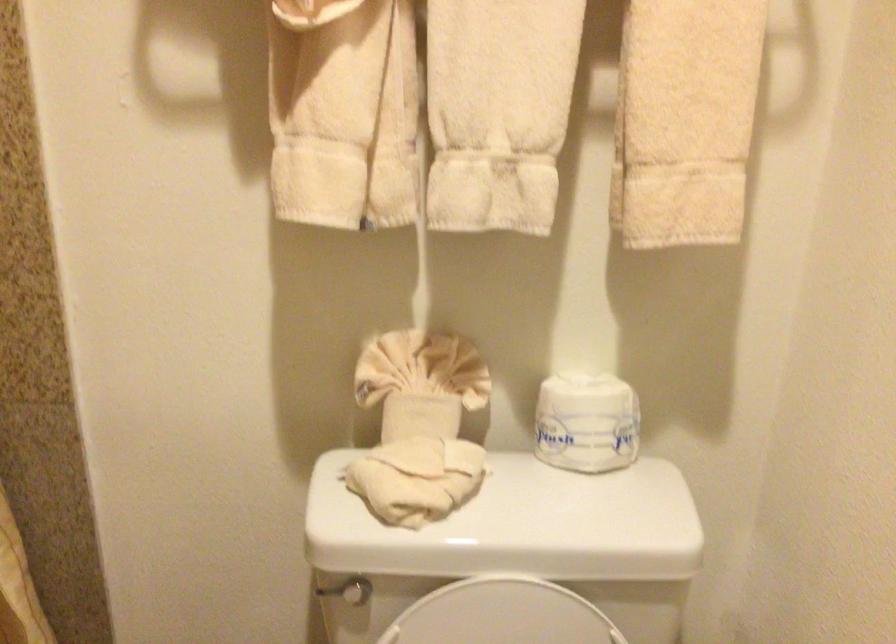
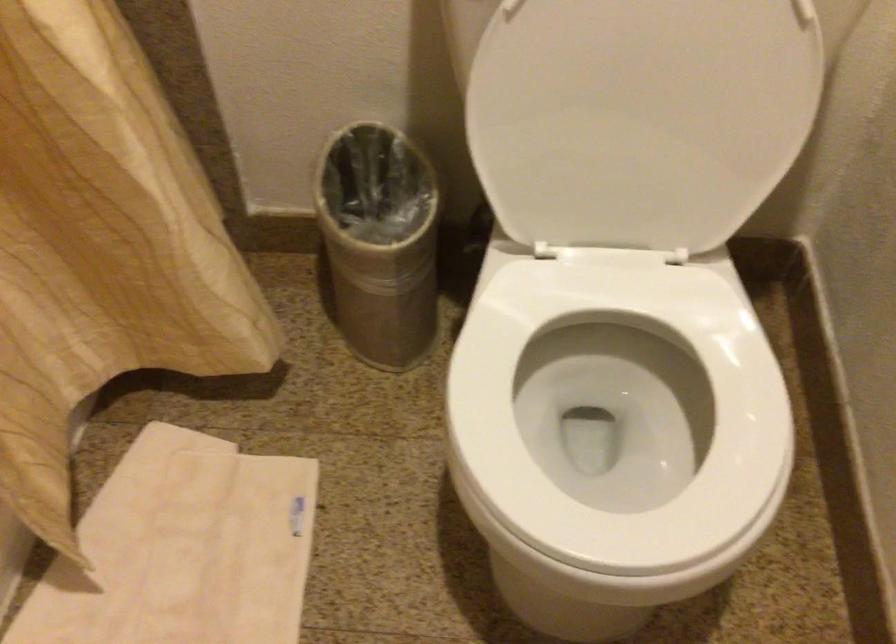
Question: The first image is from the beginning of the video and the second image is from the end. How did the camera likely rotate when shooting the video?

Choices:
 (A) Left
 (B) Right
 (C) Up
 (D) Down

Answer: (D)